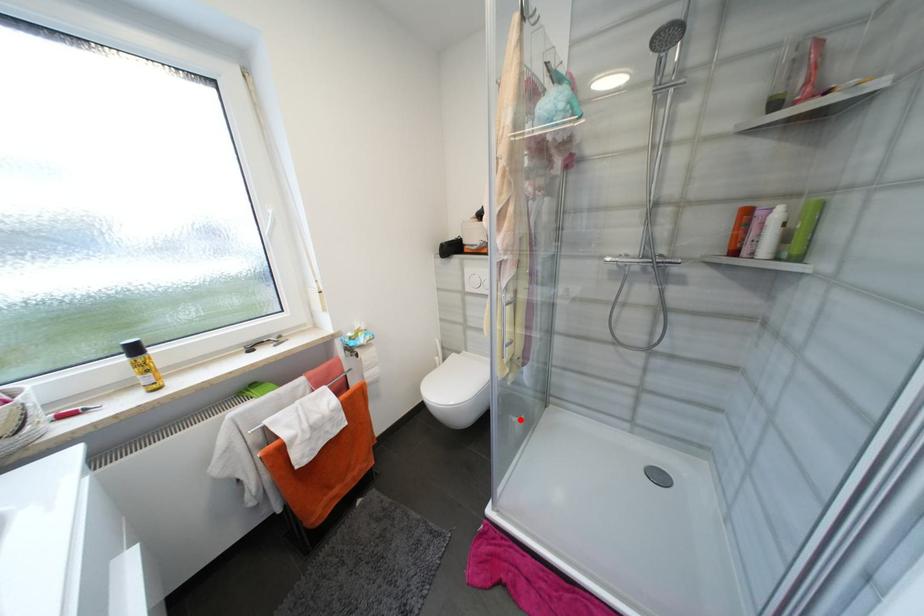
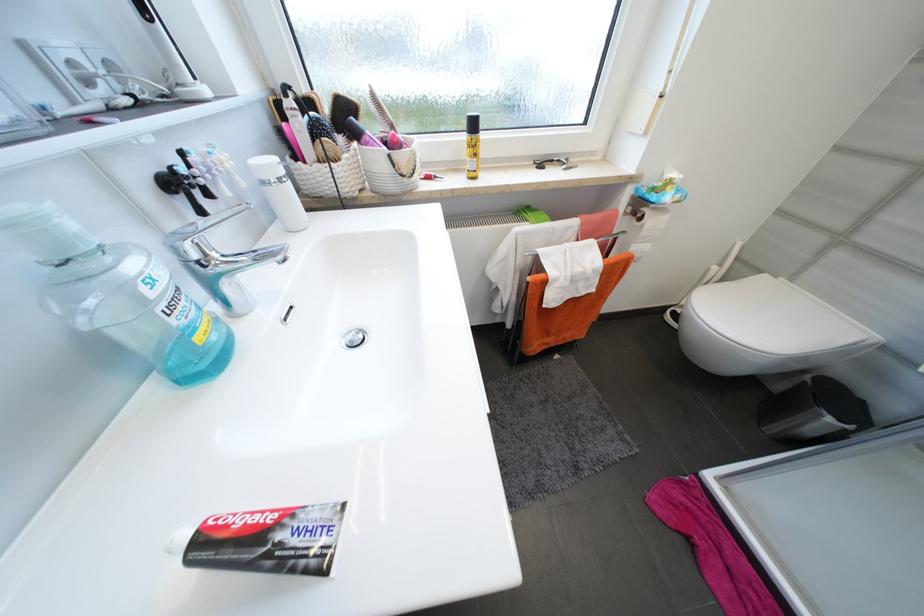
Question: I am providing you with two images of the same scene from different viewpoints. In image1, a red point is highlighted. Considering the same 3D point in image2, which of the following is correct?

Choices:
 (A) It is closer
 (B) It is farther

Answer: (A)